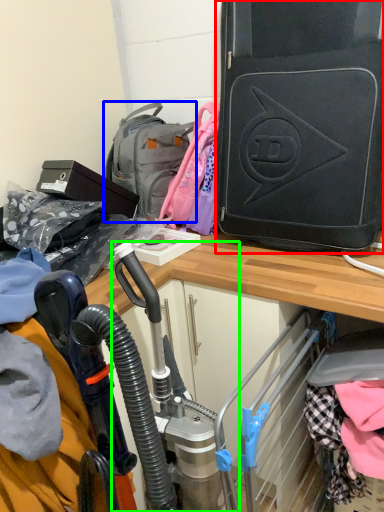
Question: Considering the real-world distances, which object is closest to luggage and bags (highlighted by a red box)? backpack (highlighted by a blue box) or sport equipment (highlighted by a green box).

Choices:
 (A) backpack
 (B) sport equipment

Answer: (A)